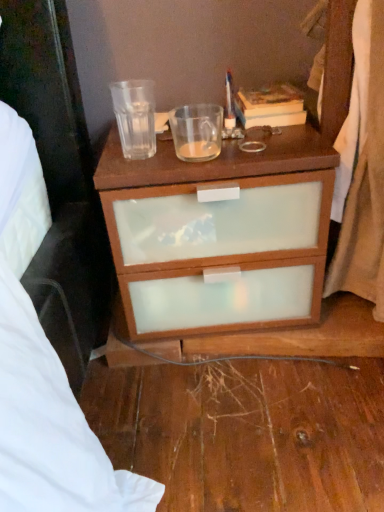
Where is `vacant region to the left of translucent glass coffee cup at upper center, marked as the second coffee cup in a left-to-right arrangement`? This screenshot has width=384, height=512. vacant region to the left of translucent glass coffee cup at upper center, marked as the second coffee cup in a left-to-right arrangement is located at coordinates (148, 147).